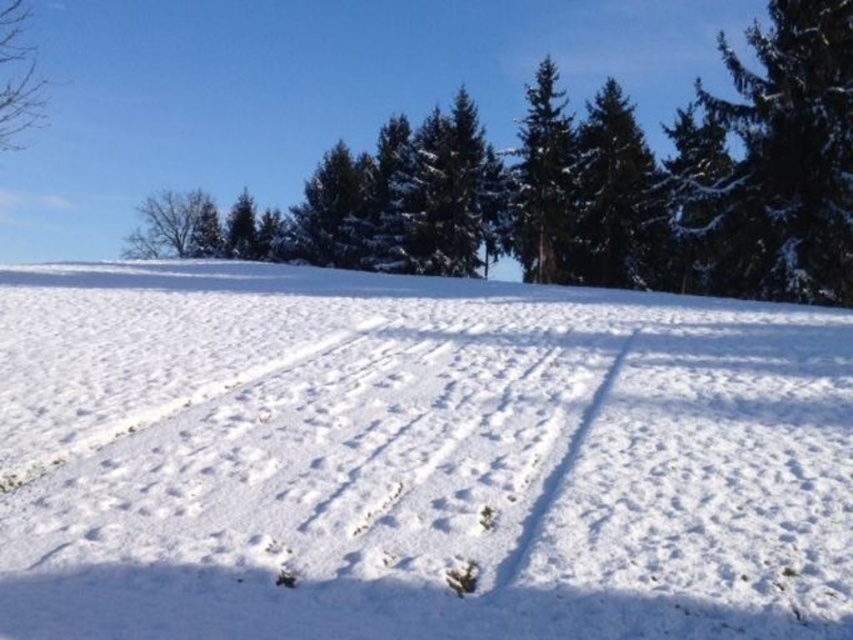
Question: Does green textured pine tree at upper right appear under green matte tree at upper center?

Choices:
 (A) yes
 (B) no

Answer: (A)

Question: Which of the following is the closest to the observer?

Choices:
 (A) green matte tree at upper center
 (B) green textured pine tree at center
 (C) white snow at center
 (D) green textured pine tree at upper right

Answer: (C)

Question: Which object is farther from the camera taking this photo?

Choices:
 (A) white snow at center
 (B) green matte tree at upper center

Answer: (B)

Question: Which point is closer to the camera?

Choices:
 (A) (39, 96)
 (B) (196, 220)
 (C) (612, 240)
 (D) (229, 403)

Answer: (D)

Question: Can you confirm if green matte tree at upper center is wider than bare branches at upper left?

Choices:
 (A) no
 (B) yes

Answer: (A)

Question: Is green textured pine tree at upper right positioned in front of bare branches at upper left?

Choices:
 (A) yes
 (B) no

Answer: (A)